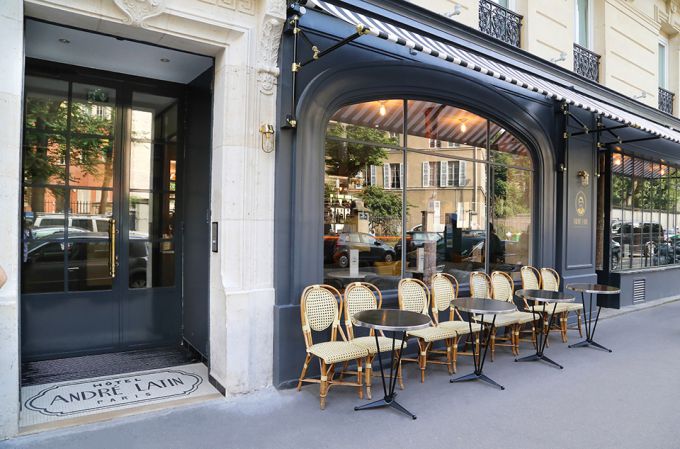
Where is `tables sitting in front of chairs`? The width and height of the screenshot is (680, 449). tables sitting in front of chairs is located at coordinates (388, 322), (488, 302), (528, 288), (595, 288).